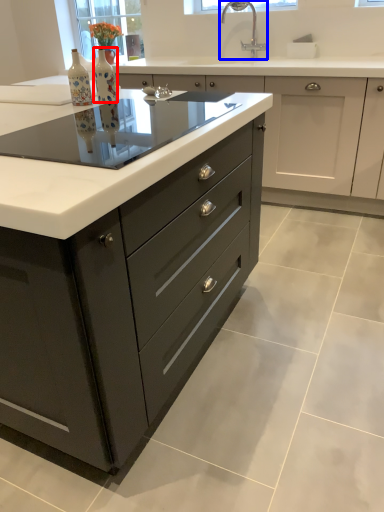
Question: Which of the following is the farthest to the observer, bottle (highlighted by a red box) or tap (highlighted by a blue box)?

Choices:
 (A) bottle
 (B) tap

Answer: (B)